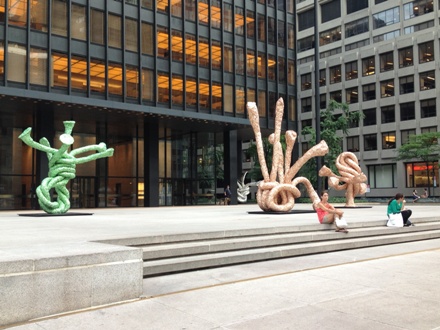
Where is `windows`? The image size is (440, 330). windows is located at coordinates (168, 85), (176, 89), (189, 92), (203, 94), (371, 68), (385, 68), (408, 64), (424, 58).